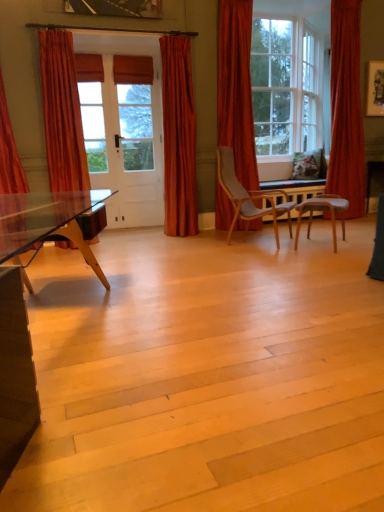
Question: From the image's perspective, is matte orange curtain at center, the 3th curtain in the right-to-left sequence, on top of velvet orange curtain at left, the fourth curtain viewed from the right?

Choices:
 (A) no
 (B) yes

Answer: (B)

Question: Is matte orange curtain at center, placed as the 3th curtain when sorted from left to right, bigger than velvet orange curtain at left, the fourth curtain viewed from the right?

Choices:
 (A) yes
 (B) no

Answer: (B)

Question: Does matte orange curtain at center, the 3th curtain in the right-to-left sequence, contain velvet orange curtain at left, which appears as the second curtain when viewed from the left?

Choices:
 (A) yes
 (B) no

Answer: (B)

Question: Are matte orange curtain at center, the 3th curtain in the right-to-left sequence, and velvet orange curtain at left, the fourth curtain viewed from the right, far apart?

Choices:
 (A) yes
 (B) no

Answer: (A)

Question: Is matte orange curtain at center, placed as the 3th curtain when sorted from left to right, at the right side of velvet orange curtain at left, which appears as the second curtain when viewed from the left?

Choices:
 (A) no
 (B) yes

Answer: (B)

Question: Considering the positions of velvet red curtain at left, the 5th curtain when ordered from right to left, and matte orange curtain at center, placed as the 3th curtain when sorted from left to right, in the image, is velvet red curtain at left, the 5th curtain when ordered from right to left, wider or thinner than matte orange curtain at center, placed as the 3th curtain when sorted from left to right,?

Choices:
 (A) thin
 (B) wide

Answer: (B)

Question: In terms of height, does velvet red curtain at left, the 5th curtain when ordered from right to left, look taller or shorter compared to matte orange curtain at center, placed as the 3th curtain when sorted from left to right?

Choices:
 (A) tall
 (B) short

Answer: (B)

Question: In the image, is velvet red curtain at left, the 5th curtain when ordered from right to left, positioned in front of or behind matte orange curtain at center, placed as the 3th curtain when sorted from left to right?

Choices:
 (A) behind
 (B) front

Answer: (B)

Question: Is point (28, 185) closer or farther from the camera than point (185, 59)?

Choices:
 (A) closer
 (B) farther

Answer: (A)

Question: Do you think velvet red curtain at right, which appears as the 2th curtain when viewed from the right, is within velvet orange curtain at right, the first curtain from the right, or outside of it?

Choices:
 (A) outside
 (B) inside

Answer: (A)

Question: Is point (236, 25) positioned closer to the camera than point (350, 152)?

Choices:
 (A) closer
 (B) farther

Answer: (A)

Question: Considering their positions, is velvet red curtain at right, the 4th curtain from the left, located in front of or behind velvet orange curtain at right, the first curtain from the right?

Choices:
 (A) front
 (B) behind

Answer: (A)

Question: From a real-world perspective, is velvet red curtain at right, the 4th curtain from the left, above or below velvet orange curtain at right, which is counted as the fifth curtain, starting from the left?

Choices:
 (A) below
 (B) above

Answer: (A)

Question: From a real-world perspective, is matte orange curtain at center, the 3th curtain in the right-to-left sequence, above or below velvet orange curtain at left, the fourth curtain viewed from the right?

Choices:
 (A) below
 (B) above

Answer: (A)

Question: From the image's perspective, relative to velvet orange curtain at left, which appears as the second curtain when viewed from the left, is matte orange curtain at center, placed as the 3th curtain when sorted from left to right, above or below?

Choices:
 (A) below
 (B) above

Answer: (B)